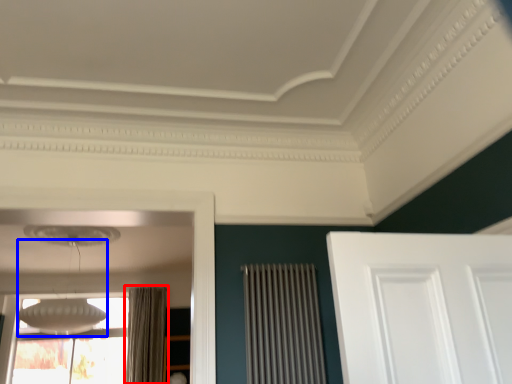
Question: Which object appears closest to the camera in this image, curtain (highlighted by a red box) or lamp (highlighted by a blue box)?

Choices:
 (A) curtain
 (B) lamp

Answer: (B)